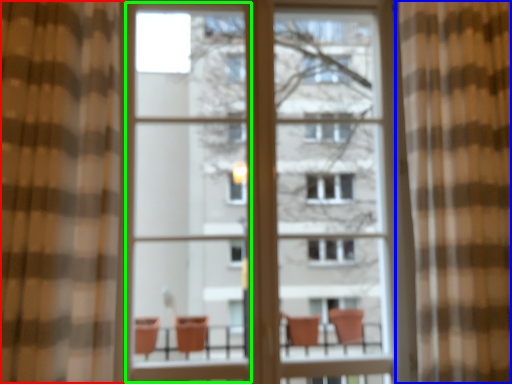
Question: Which is nearer to the curtain (highlighted by a red box)? curtain (highlighted by a blue box) or screen door (highlighted by a green box).

Choices:
 (A) curtain
 (B) screen door

Answer: (B)